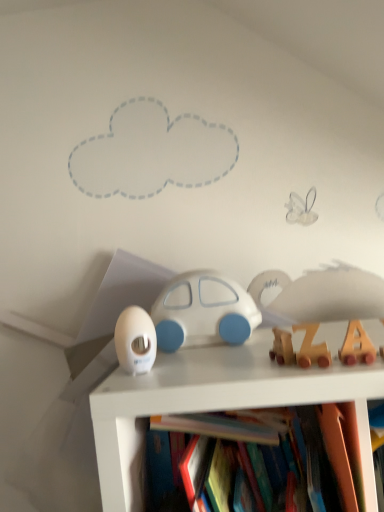
Question: From their relative heights in the image, would you say wooden letter blocks at center-right, the 1th toy positioned from the right, is taller or shorter than white glossy egg at center, placed as the third toy when sorted from front to back?

Choices:
 (A) short
 (B) tall

Answer: (A)

Question: Considering the positions of wooden letter blocks at center-right, which ranks as the fourth toy in back-to-front order, and white glossy egg at center, the 1th toy positioned from the left, in the image, is wooden letter blocks at center-right, which ranks as the fourth toy in back-to-front order, bigger or smaller than white glossy egg at center, the 1th toy positioned from the left,?

Choices:
 (A) big
 (B) small

Answer: (B)

Question: Considering the real-world distances, which object is farthest from the wooden train at right, acting as the 2th toy starting from the right?

Choices:
 (A) white glossy egg at center, arranged as the 2th toy when viewed from the back
 (B) wooden letter blocks at center-right, placed as the 1th toy when sorted from front to back
 (C) white matte car at center, the first toy viewed from the back

Answer: (A)

Question: Which of these objects is positioned closest to the wooden train at right, arranged as the third toy when viewed from the left?

Choices:
 (A) white glossy egg at center, arranged as the 2th toy when viewed from the back
 (B) white matte car at center, acting as the 3th toy starting from the right
 (C) wooden letter blocks at center-right, which ranks as the fourth toy in back-to-front order

Answer: (C)